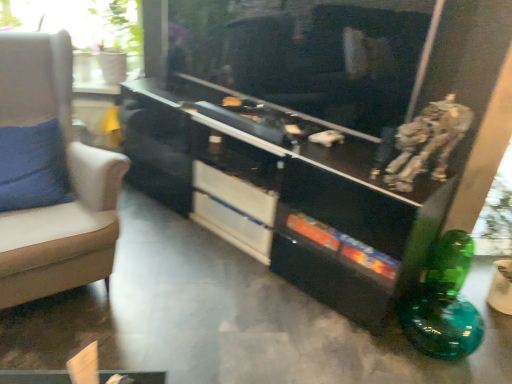
Identify the location of vacant space that is to the left of metallic silver robot at upper right. (353, 169).